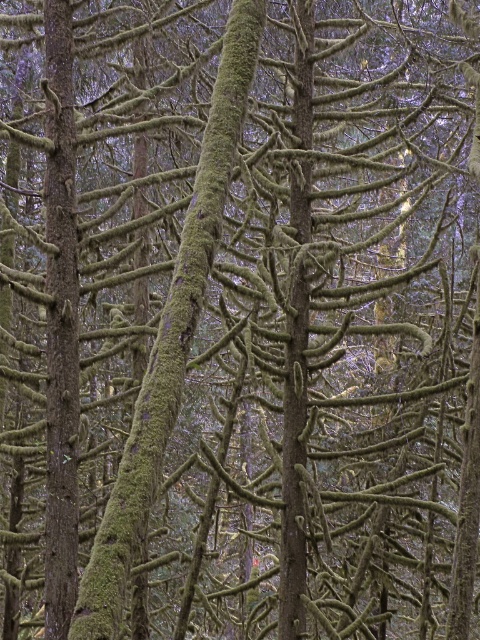
Question: Which object is closer to the camera taking this photo?

Choices:
 (A) green mossy tree trunk at center
 (B) green mossy tree trunk at left

Answer: (A)

Question: Which of the following is the closest to the observer?

Choices:
 (A) 247,58
 (B) 75,506

Answer: (A)

Question: Which of the following is the farthest from the observer?

Choices:
 (A) green mossy tree trunk at left
 (B) green mossy tree trunk at center

Answer: (A)

Question: Is green mossy tree trunk at center to the right of green mossy tree trunk at left from the viewer's perspective?

Choices:
 (A) no
 (B) yes

Answer: (B)

Question: Is green mossy tree trunk at center below green mossy tree trunk at left?

Choices:
 (A) no
 (B) yes

Answer: (B)

Question: Can you confirm if green mossy tree trunk at center is positioned above green mossy tree trunk at left?

Choices:
 (A) no
 (B) yes

Answer: (A)